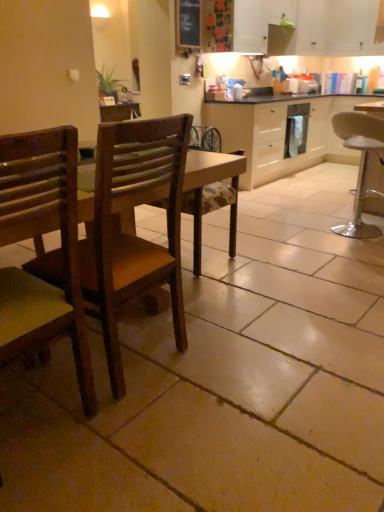
Question: Choose the correct answer: Is white matte cabinet at upper center, the second cabinetry viewed from the top, inside wooden chair at left, placed as the second chair when sorted from front to back, or outside it?

Choices:
 (A) inside
 (B) outside

Answer: (B)

Question: Looking at their shapes, would you say white matte cabinet at upper center, the second cabinetry viewed from the top, is wider or thinner than wooden chair at left, which appears as the second chair when viewed from the right?

Choices:
 (A) thin
 (B) wide

Answer: (A)

Question: Estimate the real-world distances between objects in this image. Which object is farther from the white plastic stool at right, which appears as the 1th chair when viewed from the right?

Choices:
 (A) white glossy dishwasher at center
 (B) white matte cabinet at upper center, marked as the 2th cabinetry in a bottom-to-top arrangement
 (C) wooden chair at left, acting as the second chair starting from the back
 (D) wooden chair at left, which is the third chair from right to left
 (E) white matte cabinet at center, which is the 3th cabinetry from top to bottom

Answer: (D)

Question: Which is nearer to the white matte cabinet at upper center, marked as the 2th cabinetry in a bottom-to-top arrangement?

Choices:
 (A) wooden chair at left, acting as the third chair starting from the back
 (B) wooden chair at left, which appears as the second chair when viewed from the right
 (C) chalkboard at upper center
 (D) white glossy dishwasher at center
 (E) white plastic stool at right, the 3th chair positioned from the front

Answer: (D)